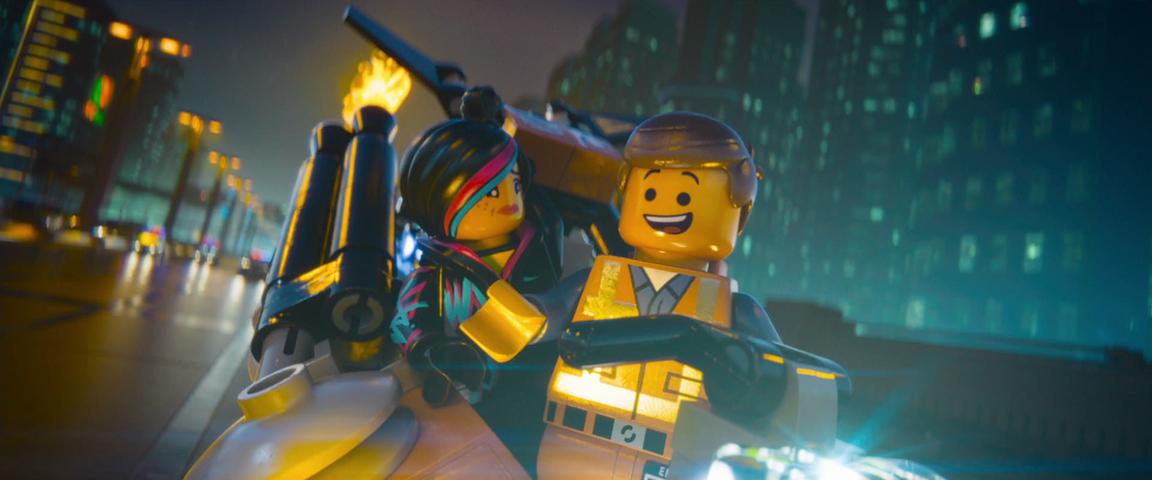
The height and width of the screenshot is (480, 1152). Find the location of `light`. light is located at coordinates (175, 46).